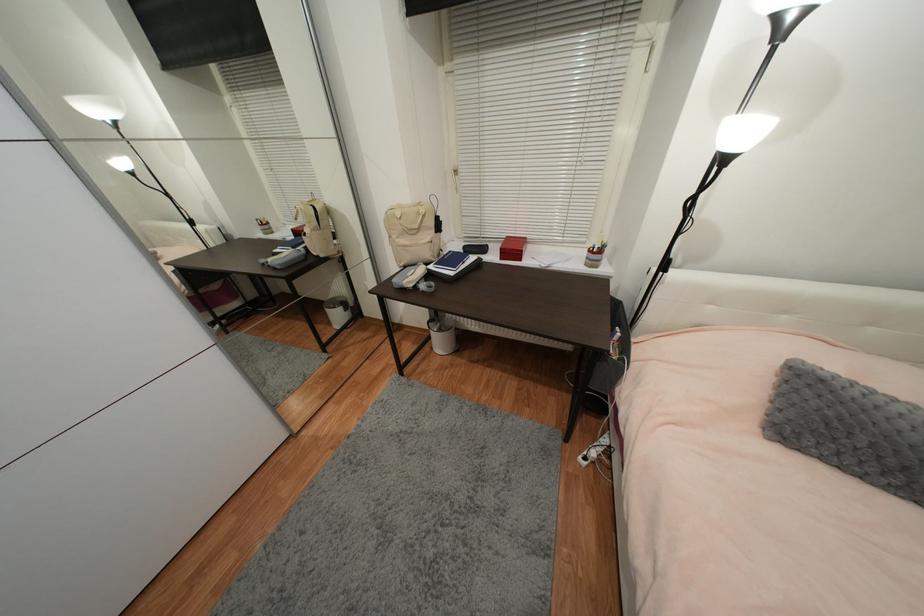
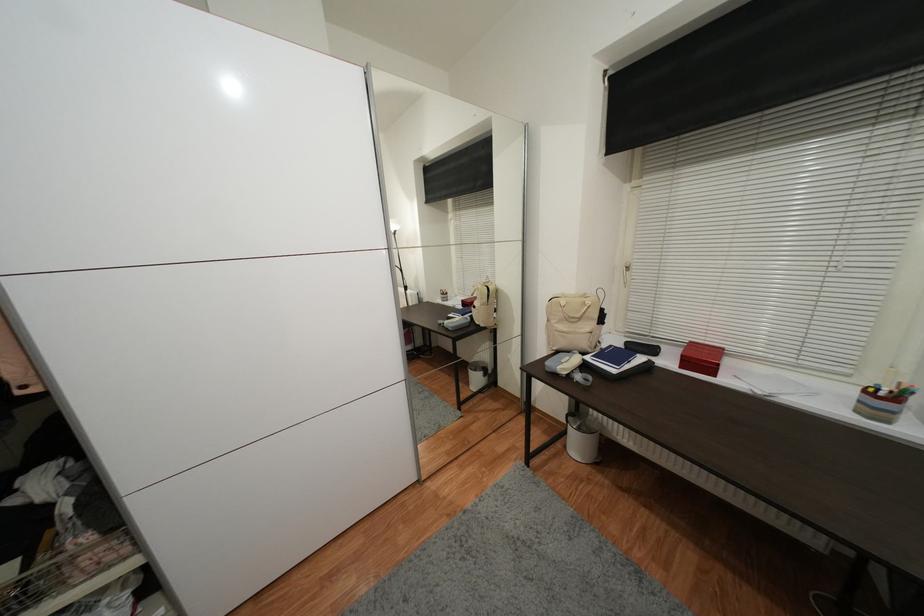
Locate, in the second image, the point that corresponds to point 517,251 in the first image.

(706, 361)